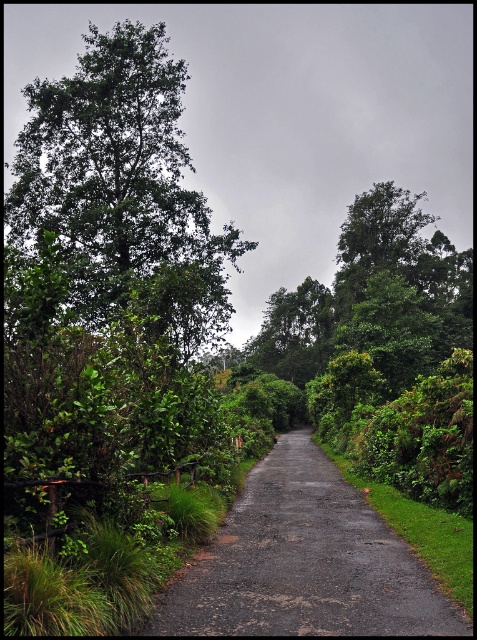
Question: Is green leafy tree at left wider than dark gray asphalt road at center?

Choices:
 (A) no
 (B) yes

Answer: (B)

Question: Can you confirm if green leafy tree at left is positioned to the left of dark gray asphalt road at center?

Choices:
 (A) yes
 (B) no

Answer: (A)

Question: Is green leafy tree at left closer to camera compared to dark gray asphalt road at center?

Choices:
 (A) no
 (B) yes

Answer: (A)

Question: Which of the following is the farthest from the observer?

Choices:
 (A) green leafy tree at left
 (B) dark gray asphalt road at center

Answer: (A)